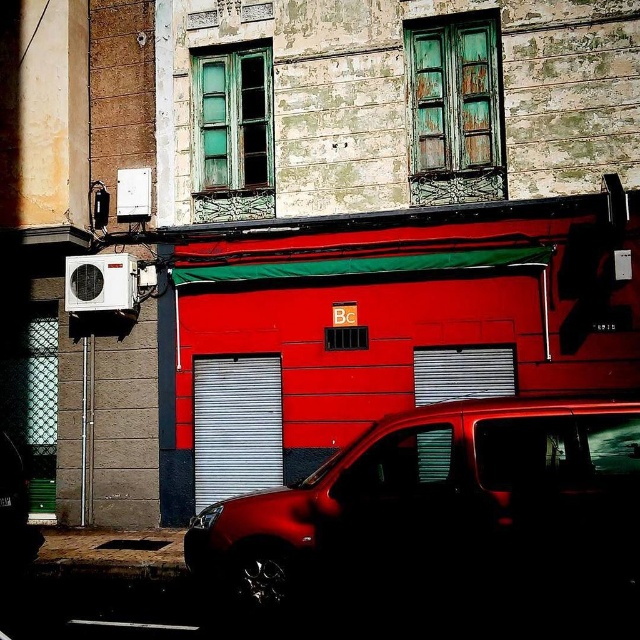
In the scene shown: Who is higher up, glossy metallic van at center or metallic silver garage door at center?

metallic silver garage door at center

Is glossy metallic van at center positioned in front of metallic silver garage door at center?

Yes, glossy metallic van at center is closer to the viewer.

Which is in front, point (602, 452) or point (204, 403)?

Point (602, 452) is in front.

Locate an element on the screen. The width and height of the screenshot is (640, 640). glossy metallic van at center is located at coordinates (440, 513).